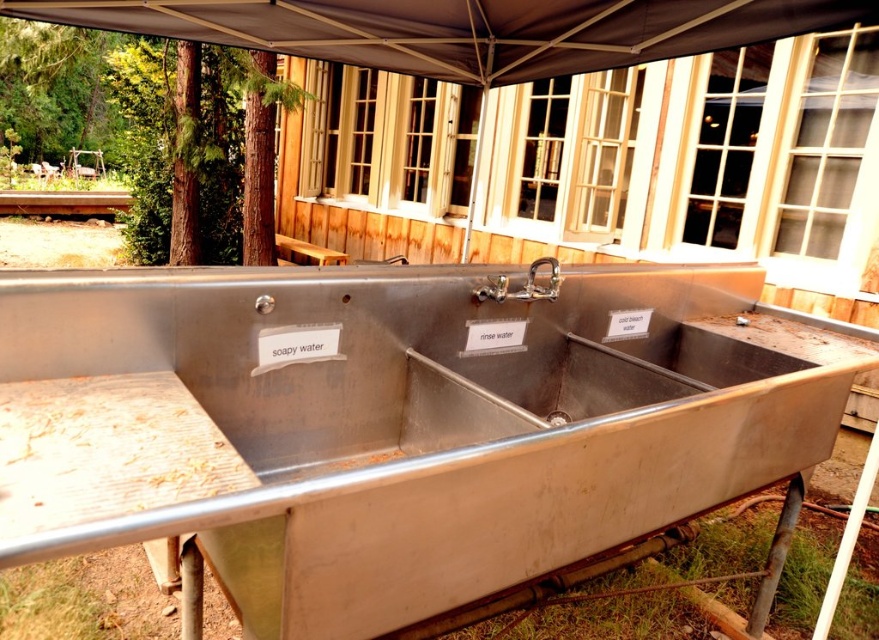
You are standing 2 meters away from the brown fabric canopy at upper center. Can you reach it without moving your feet?

The brown fabric canopy at upper center is 2.49 meters away from the viewer. Since you are standing 2 meters away, you are still 0.49 meters away from it, so you cannot reach it without moving closer.

From the picture: You are standing in front of the utility sink and need to determine the relative positions of two points on the sink. Which point is closer to you, point (543, 260) or point (333, 257)?

Point (543, 260) is closer to the camera than point (333, 257), so the point closer to you is point (543, 260).

You are setting up a picnic and need to fill a water jug. You see a silver metallic faucet at upper center and a brown wooden picnic table at center. Which object is closer to you that you can reach first?

The silver metallic faucet at upper center is closer to the viewer than the brown wooden picnic table at center, so you can reach it first.